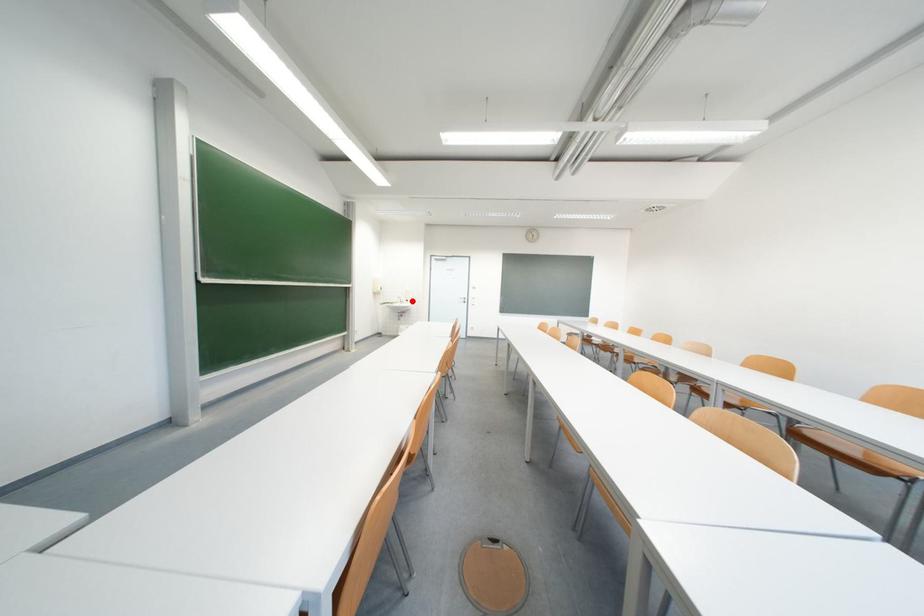
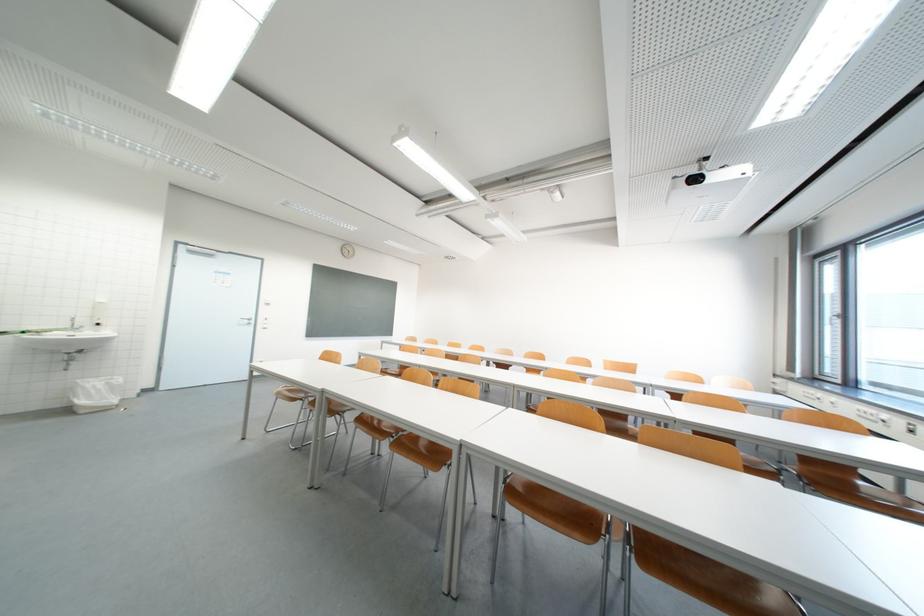
In the second image, find the point that corresponds to the highlighted location in the first image.

(93, 323)